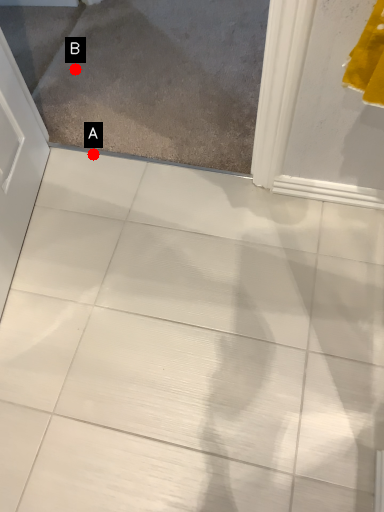
Question: Two points are circled on the image, labeled by A and B beside each circle. Which of the following is the closest to the observer?

Choices:
 (A) A is closer
 (B) B is closer

Answer: (A)